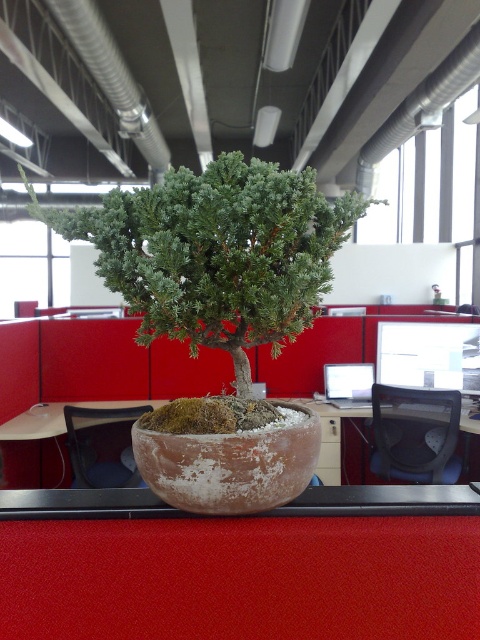
Question: Can you confirm if green textured bonsai at center is wider than matte wood computer desk at center?

Choices:
 (A) no
 (B) yes

Answer: (B)

Question: Which point is closer to the camera taking this photo?

Choices:
 (A) (40, 428)
 (B) (371, 392)
 (C) (468, 438)
 (D) (256, 208)

Answer: (D)

Question: Can you confirm if green textured bonsai at center is smaller than matte wood computer desk at center?

Choices:
 (A) no
 (B) yes

Answer: (B)

Question: Which of these objects is positioned farthest from the matte black monitor at center?

Choices:
 (A) green textured bonsai at center
 (B) matte brown desk at center

Answer: (A)

Question: Which object is farther from the camera taking this photo?

Choices:
 (A) matte wood computer desk at center
 (B) green textured bonsai at center

Answer: (A)

Question: Is matte wood computer desk at center to the left of matte black monitor at center from the viewer's perspective?

Choices:
 (A) no
 (B) yes

Answer: (B)